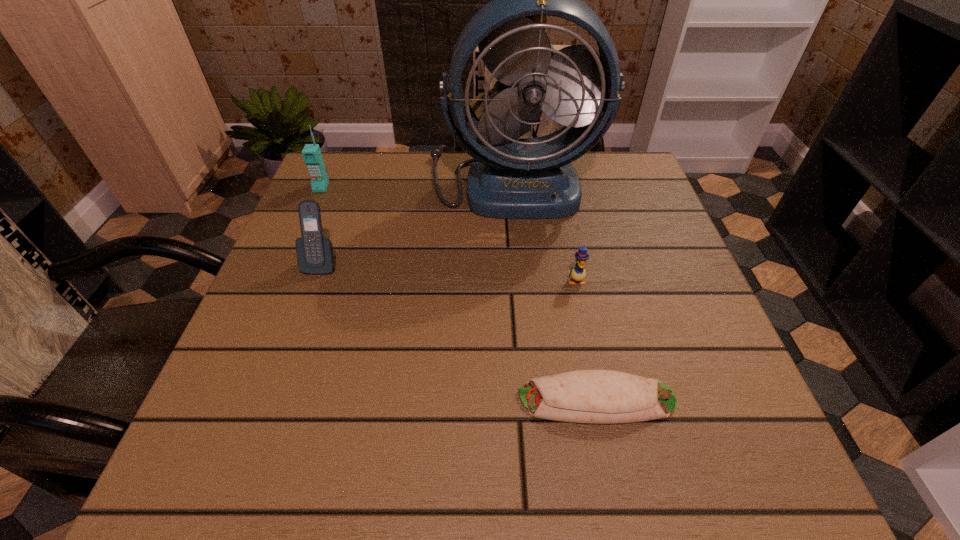
Image resolution: width=960 pixels, height=540 pixels. I want to click on the tallest object, so click(513, 178).

Find the location of a particular element. The width and height of the screenshot is (960, 540). the leftmost object is located at coordinates (311, 153).

Identify the location of the farther cellular telephone. (311, 153).

Image resolution: width=960 pixels, height=540 pixels. Identify the location of the second object from left to right. (315, 255).

Image resolution: width=960 pixels, height=540 pixels. Identify the location of the right cellular telephone. (315, 255).

At what (x,y) coordinates should I click in order to perform the action: click on the fourth tallest object. Please return your answer as a coordinate pair (x, y). Looking at the image, I should click on (578, 273).

At what (x,y) coordinates should I click in order to perform the action: click on the shortest object. Please return your answer as a coordinate pair (x, y). This screenshot has height=540, width=960. Looking at the image, I should click on (586, 396).

This screenshot has height=540, width=960. In order to click on burrito in this screenshot , I will do `click(586, 396)`.

You are a GUI agent. You are given a task and a screenshot of the screen. Output one action in this format:
    pyautogui.click(x=<x>, y=<y>)
    Task: Click on the free space located in front of the tallest object to blow air
    This screenshot has height=540, width=960.
    Given the screenshot: What is the action you would take?
    pyautogui.click(x=526, y=350)

I want to click on vacant region located 0.370m on the keypad of the left cellular telephone, so pyautogui.click(x=267, y=313).